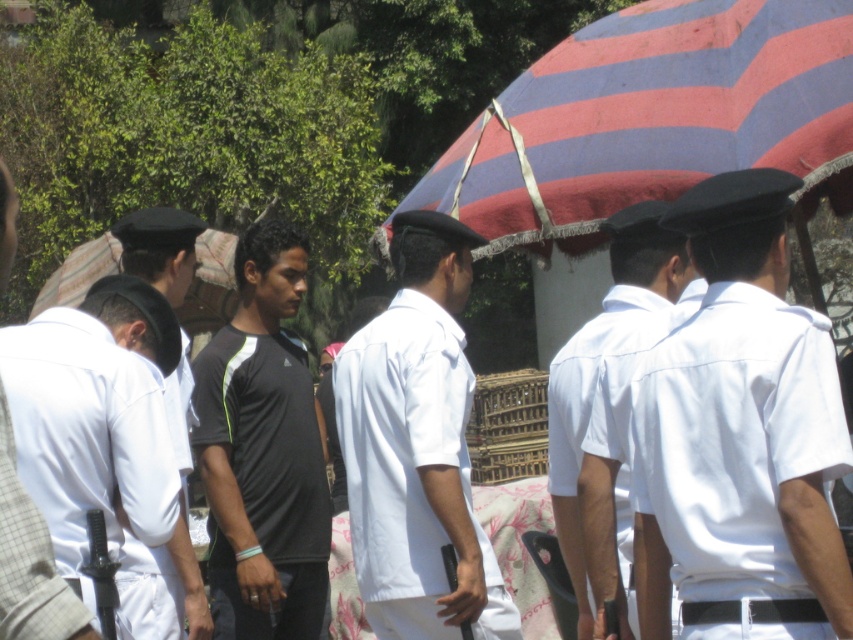
You are a photographer at this event and need to arrange two subjects for a photo. The subjects are the white smooth shirt at right and the white cotton shirt at left. Based on their current positions, which shirt should you move to ensure they are side by side?

You should move the white cotton shirt at left to the right to align with the white smooth shirt at right since the white smooth shirt at right is already positioned to the right of the white cotton shirt at left.

You are a photographer at the event. You need to capture a group photo where both the white smooth shirt at right and the white cotton shirt at left are visible. Considering their shirt widths, which shirt might appear wider in the photo?

The white smooth shirt at right will appear wider in the photo because its width surpasses that of the white cotton shirt at left.